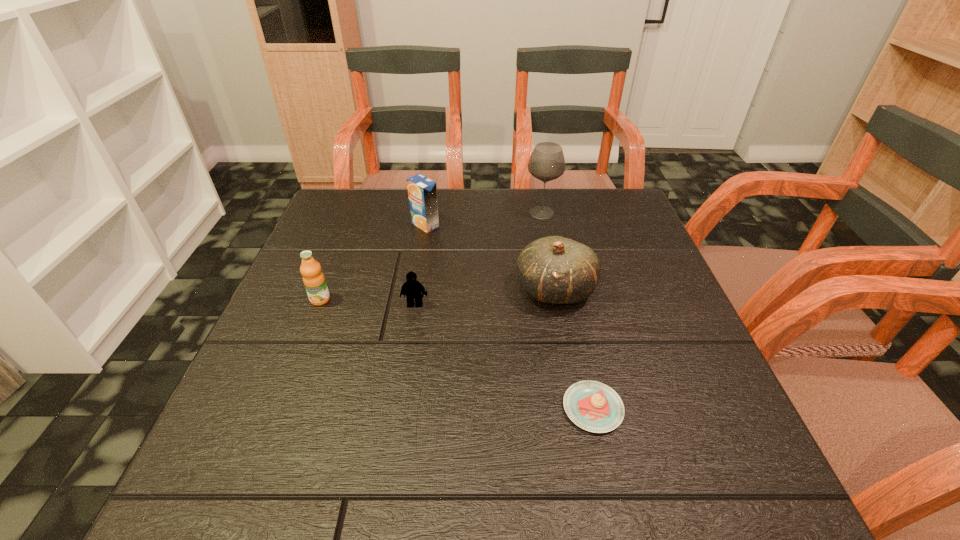
Find the location of a particular element. This screenshot has height=540, width=960. wineglass is located at coordinates (546, 163).

This screenshot has height=540, width=960. In order to click on the farther orange juice in this screenshot , I will do `click(422, 191)`.

Where is `gourd`? gourd is located at coordinates (557, 270).

What are the coordinates of `the left orange juice` in the screenshot? It's located at (314, 281).

You are a GUI agent. You are given a task and a screenshot of the screen. Output one action in this format:
    pyautogui.click(x=<x>, y=<y>)
    Task: Click on the leftmost object
    The image size is (960, 540).
    Given the screenshot: What is the action you would take?
    pyautogui.click(x=314, y=281)

Identify the location of Lego. (412, 288).

Identify the location of the shortest object. Image resolution: width=960 pixels, height=540 pixels. (593, 406).

At what (x,y) coordinates should I click in order to perform the action: click on the nearest object. Please return your answer as a coordinate pair (x, y). The height and width of the screenshot is (540, 960). Looking at the image, I should click on (593, 406).

This screenshot has width=960, height=540. What are the coordinates of `free space located 0.370m on the left of the wineglass` in the screenshot? It's located at (391, 213).

Where is `vacant space situated 0.250m on the left of the right orange juice`? The image size is (960, 540). vacant space situated 0.250m on the left of the right orange juice is located at coordinates coord(317,225).